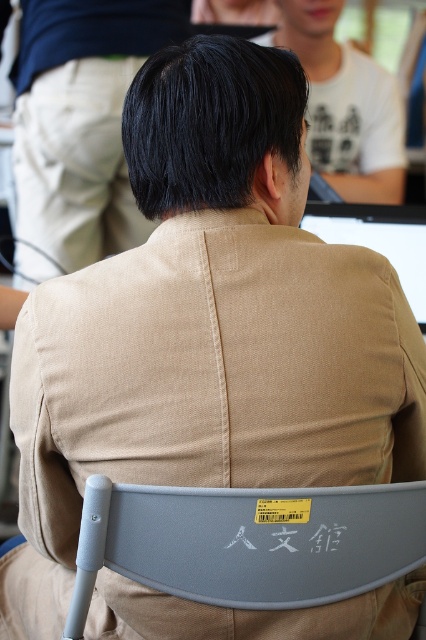
You are a delivery robot in a library. You need to deliver a package to the person sitting in the gray plastic chair at lower center. The robot is 1.2 meters tall. Can the robot see the matte black hair at upper center of the person while approaching the chair?

The distance between the gray plastic chair at lower center and matte black hair at upper center is 1.65 meters. Since the robot is 1.2 meters tall, it can see the matte black hair at upper center as the distance is greater than the robot height.

You are an interior designer planning to place a new desk between the gray plastic chair at lower center and the matte black hair at upper center. Based on their widths, which object requires more space horizontally?

The gray plastic chair at lower center requires more horizontal space because its width surpasses that of the matte black hair at upper center.